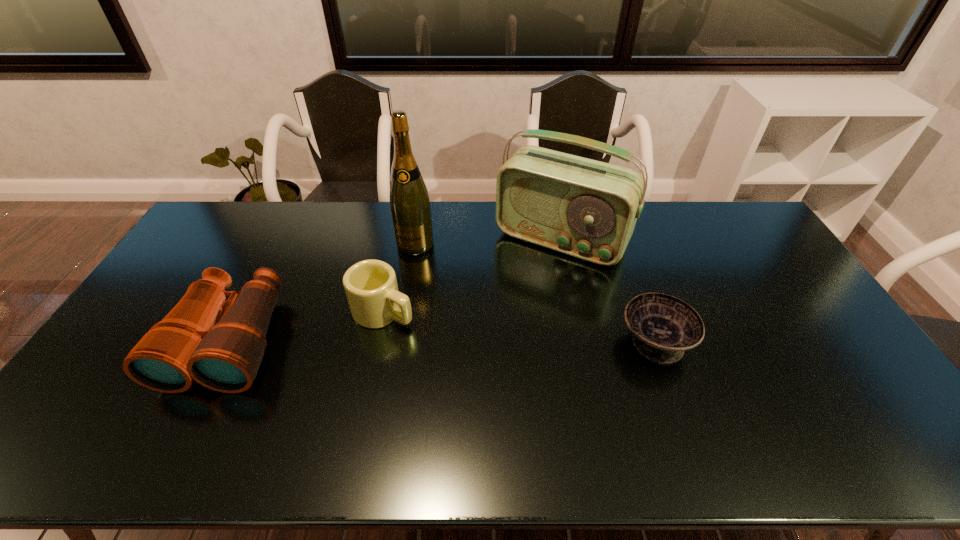
Identify the location of free space located 0.110m on the front panel of the radio receiver. (521, 289).

Locate an element on the screen. free space located on the front panel of the radio receiver is located at coordinates (512, 304).

This screenshot has width=960, height=540. I want to click on free space located with the handle on the side of the mug, so point(426,330).

Where is `free point located with the handle on the side of the mug`? free point located with the handle on the side of the mug is located at coordinates (437, 336).

Image resolution: width=960 pixels, height=540 pixels. Identify the location of vacant space located 0.100m with the handle on the side of the mug. (437, 336).

Where is `wine bottle situated at the far edge`? The height and width of the screenshot is (540, 960). wine bottle situated at the far edge is located at coordinates (410, 206).

Locate an element on the screen. The width and height of the screenshot is (960, 540). radio receiver present at the far edge is located at coordinates (588, 209).

In order to click on object present at the near edge in this screenshot , I will do pos(224,354).

Where is `free space at the far edge`? Image resolution: width=960 pixels, height=540 pixels. free space at the far edge is located at coordinates [259, 238].

This screenshot has width=960, height=540. In the image, there is a desktop. Identify the location of vacant space at the near edge. (472, 389).